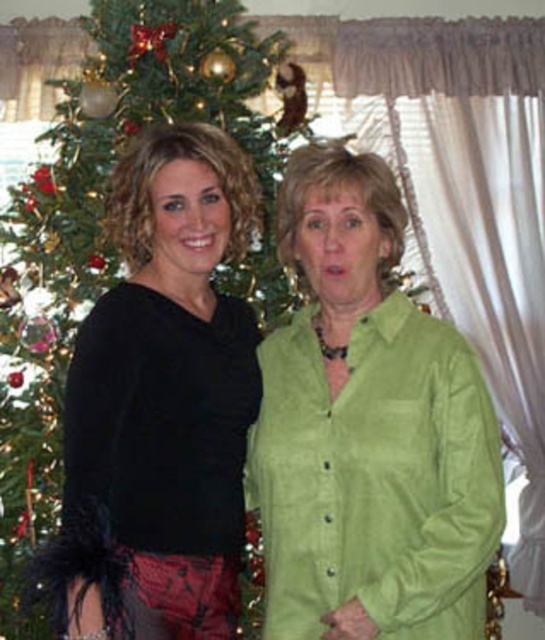
Is green suede blouse at center shorter than black satin blouse at left?

Correct, green suede blouse at center is not as tall as black satin blouse at left.

Where is `green suede blouse at center`? green suede blouse at center is located at coordinates (367, 429).

In order to click on green suede blouse at center in this screenshot , I will do `click(367, 429)`.